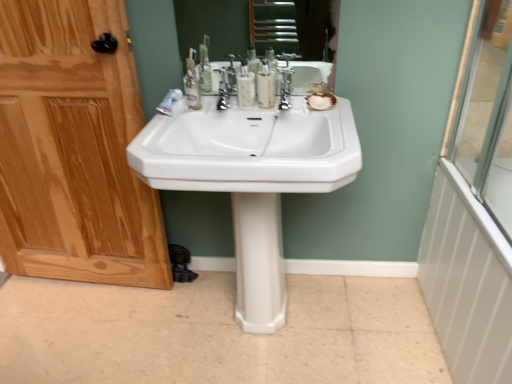
Question: Which direction should I rotate to face translucent plastic mouthwash at center, which is the second mouthwash from left to right, — up or down?

Choices:
 (A) down
 (B) up

Answer: (B)

Question: From the image's perspective, is translucent plastic mouthwash at center, which ranks as the 1th mouthwash in right-to-left order, below white glossy pedestal at center?

Choices:
 (A) no
 (B) yes

Answer: (A)

Question: Considering the relative sizes of translucent plastic mouthwash at center, which is the second mouthwash from left to right, and white glossy pedestal at center in the image provided, is translucent plastic mouthwash at center, which is the second mouthwash from left to right, smaller than white glossy pedestal at center?

Choices:
 (A) yes
 (B) no

Answer: (A)

Question: Is translucent plastic mouthwash at center, which is the second mouthwash from left to right, to the right of white glossy pedestal at center from the viewer's perspective?

Choices:
 (A) yes
 (B) no

Answer: (A)

Question: Is white glossy pedestal at center a part of translucent plastic mouthwash at center, which ranks as the 1th mouthwash in right-to-left order?

Choices:
 (A) no
 (B) yes

Answer: (A)

Question: Is translucent plastic mouthwash at center, which ranks as the 1th mouthwash in right-to-left order, taller than white glossy pedestal at center?

Choices:
 (A) no
 (B) yes

Answer: (A)

Question: Is translucent plastic mouthwash at center, which is the second mouthwash from left to right, outside of white glossy pedestal at center?

Choices:
 (A) no
 (B) yes

Answer: (B)

Question: Does polished chrome faucet at center, the first faucet viewed from the right, lie behind white glossy toothpaste at center?

Choices:
 (A) no
 (B) yes

Answer: (A)

Question: Does polished chrome faucet at center, which is the 2th faucet from left to right, have a lesser height compared to white glossy toothpaste at center?

Choices:
 (A) no
 (B) yes

Answer: (A)

Question: Is polished chrome faucet at center, which is the 2th faucet from left to right, turned away from white glossy toothpaste at center?

Choices:
 (A) yes
 (B) no

Answer: (B)

Question: Does polished chrome faucet at center, the first faucet viewed from the right, have a larger size compared to white glossy toothpaste at center?

Choices:
 (A) no
 (B) yes

Answer: (B)

Question: Would you consider polished chrome faucet at center, the first faucet viewed from the right, to be distant from white glossy toothpaste at center?

Choices:
 (A) yes
 (B) no

Answer: (B)

Question: Can you confirm if polished chrome faucet at center, which is the 2th faucet from left to right, is thinner than white glossy toothpaste at center?

Choices:
 (A) no
 (B) yes

Answer: (B)

Question: Does white glossy pedestal at center touch transparent glass shower door at right?

Choices:
 (A) no
 (B) yes

Answer: (A)